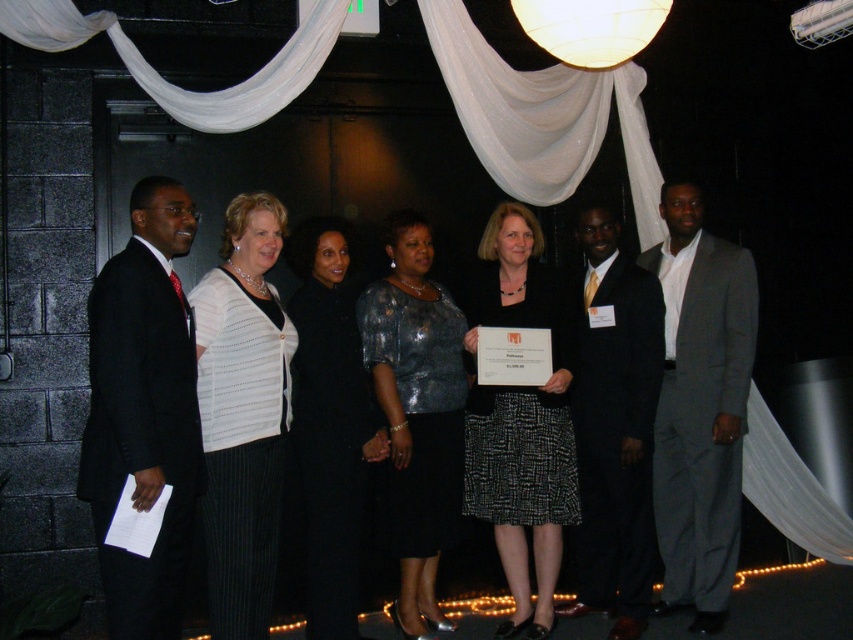
Question: Which point is closer to the camera?

Choices:
 (A) (496, 307)
 (B) (625, 573)
 (C) (254, 456)
 (D) (148, 301)

Answer: (D)

Question: Can you confirm if gray suit at right is wider than black sequined dress at center?

Choices:
 (A) yes
 (B) no

Answer: (B)

Question: Observing the image, what is the correct spatial positioning of sparkly silver blouse at center in reference to black sequined dress at center?

Choices:
 (A) above
 (B) below

Answer: (B)

Question: Does gray suit at right appear on the right side of black sequined dress at center?

Choices:
 (A) no
 (B) yes

Answer: (B)

Question: Which point is closer to the camera taking this photo?

Choices:
 (A) (334, 436)
 (B) (645, 369)
 (C) (740, 314)

Answer: (A)

Question: Which point is farther to the camera?

Choices:
 (A) (672, 200)
 (B) (125, 444)
 (C) (421, 272)

Answer: (A)